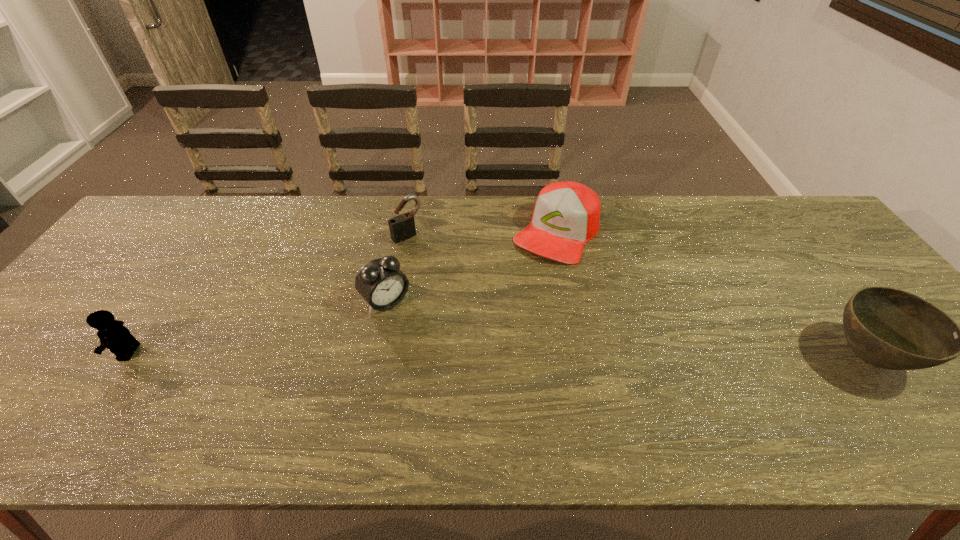
You are a GUI agent. You are given a task and a screenshot of the screen. Output one action in this format:
    pyautogui.click(x=<x>, y=<y>)
    Task: Click on the vacant space located 0.290m on the front-facing side of the fourth object from left to right
    The height and width of the screenshot is (540, 960).
    Given the screenshot: What is the action you would take?
    pyautogui.click(x=489, y=329)

The height and width of the screenshot is (540, 960). What are the coordinates of `vacant space located 0.070m on the front-facing side of the fourth object from left to right` in the screenshot? It's located at point(528,275).

Find the location of a particular element. The height and width of the screenshot is (540, 960). vacant space located 0.300m on the front-facing side of the fourth object from left to right is located at coordinates (487, 332).

In order to click on vacant space located 0.240m on the front side of the third nearest object in this screenshot , I will do `click(462, 375)`.

Where is `blank area located 0.150m on the front side of the third nearest object`? The width and height of the screenshot is (960, 540). blank area located 0.150m on the front side of the third nearest object is located at coordinates (438, 350).

At what (x,y) coordinates should I click in order to perform the action: click on vacant region located on the front side of the third nearest object. Please return your answer as a coordinate pair (x, y). Looking at the image, I should click on (448, 361).

The height and width of the screenshot is (540, 960). In order to click on padlock present at the far edge in this screenshot , I will do `click(402, 227)`.

Where is `baseball cap at the far edge`? The width and height of the screenshot is (960, 540). baseball cap at the far edge is located at coordinates (567, 214).

Identify the location of object that is positioned at the near edge. (889, 328).

This screenshot has width=960, height=540. I want to click on object positioned at the right edge, so click(x=889, y=328).